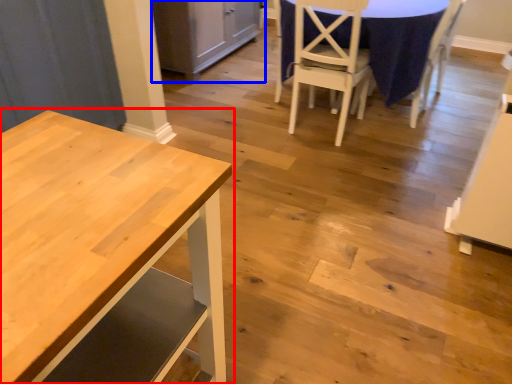
Question: Which object is further to the camera taking this photo, table (highlighted by a red box) or cabinetry (highlighted by a blue box)?

Choices:
 (A) table
 (B) cabinetry

Answer: (B)